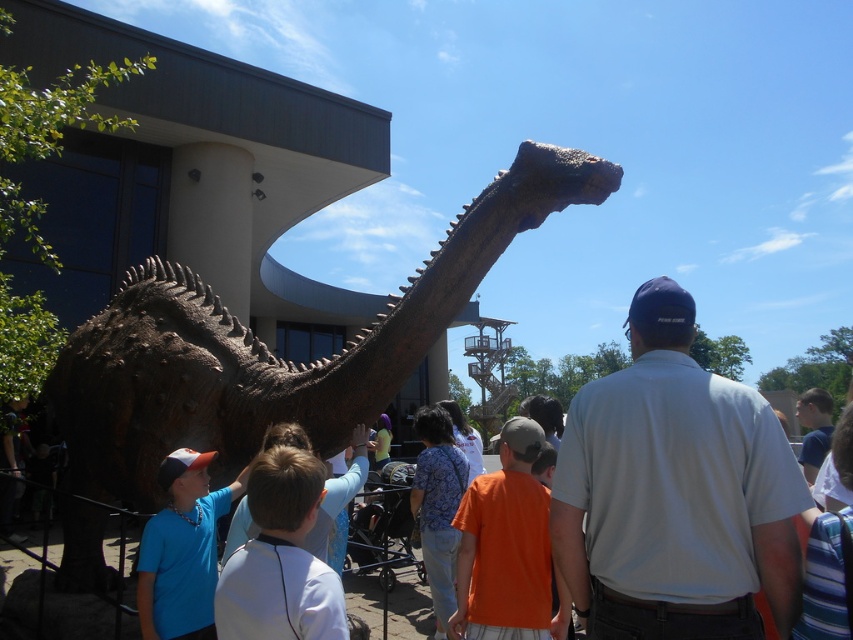
You are a photographer at the museum and want to capture both the blue shirt at left and orange shirt at center in a single photo. Which person should you focus on first to ensure both are in frame?

The blue shirt at left is smaller in size compared to orange shirt at center, so focusing on the orange shirt at center first would help ensure both are captured in the frame since it occupies more space and is easier to locate.